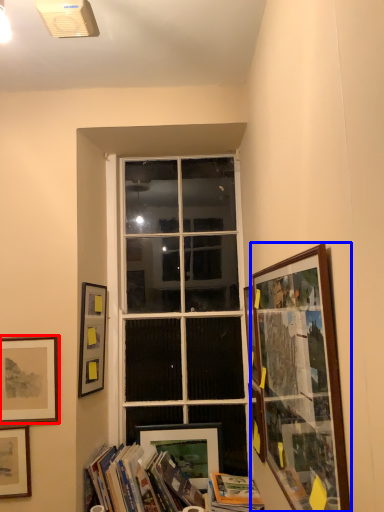
Question: Which object appears farthest to the camera in this image, picture frame (highlighted by a red box) or picture frame (highlighted by a blue box)?

Choices:
 (A) picture frame
 (B) picture frame

Answer: (A)